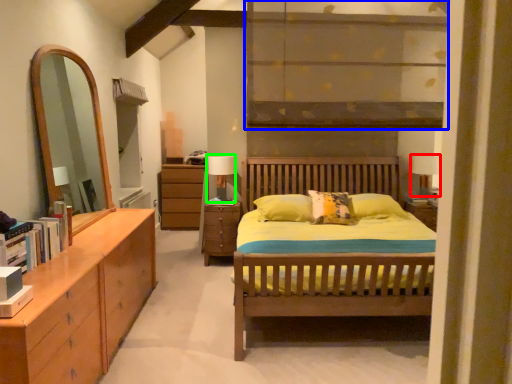
Question: Which object is positioned closest to table lamp (highlighted by a red box)? Select from shelf (highlighted by a blue box) and table lamp (highlighted by a green box).

Choices:
 (A) shelf
 (B) table lamp

Answer: (B)